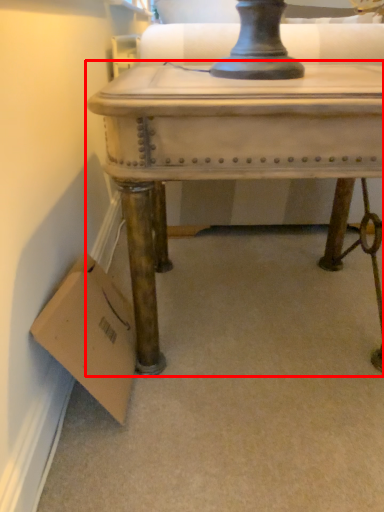
Question: From the image, what is the correct spatial relationship of table (annotated by the red box) in relation to cardboard box?

Choices:
 (A) right
 (B) left

Answer: (A)